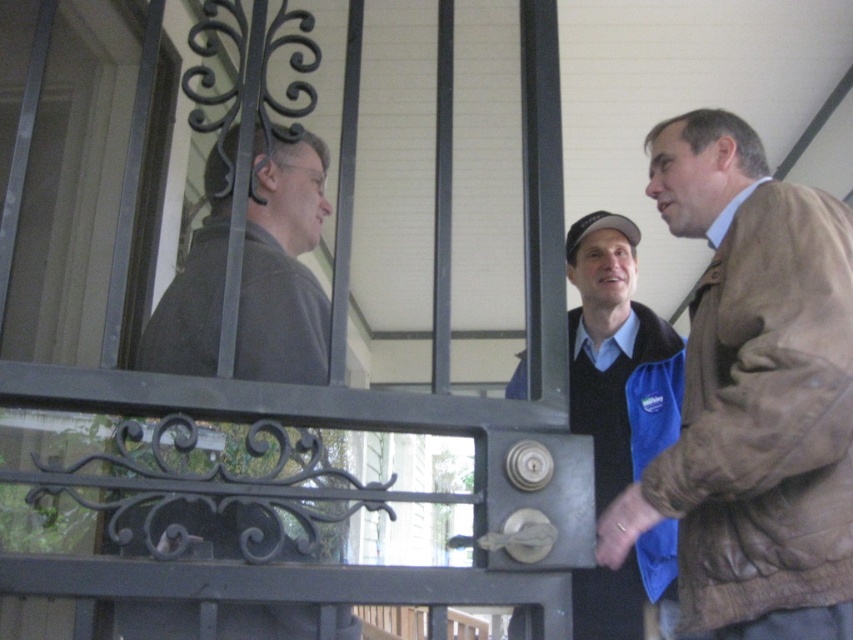
You are a delivery person trying to hand a package to the person behind the gate. The gate has a narrow opening between the bars. The brown leather jacket at right and the blue fabric vest at center are blocking your path. Which person should you approach to avoid the narrow opening?

The brown leather jacket at right has a greater width than the blue fabric vest at center, so approaching the blue fabric vest at center would be better to avoid the narrow opening.

Based on the photo, you are a delivery person trying to hand a package to the recipient behind the metal gate. The gate has a small opening between its bars. You have a package that is 15 cm wide. Can you pass the package through the opening between the dark gray jacket at left and the blue fabric vest at center?

The dark gray jacket at left is located above the blue fabric vest at center, so the vertical space between them is sufficient to pass the package through the opening between the dark gray jacket at left and the blue fabric vest at center since the package is only 15 cm wide.

Based on the scene description, which object is larger in size between the dark gray jacket at left and the blue fabric vest at center?

The blue fabric vest at center is larger than the dark gray jacket at left.